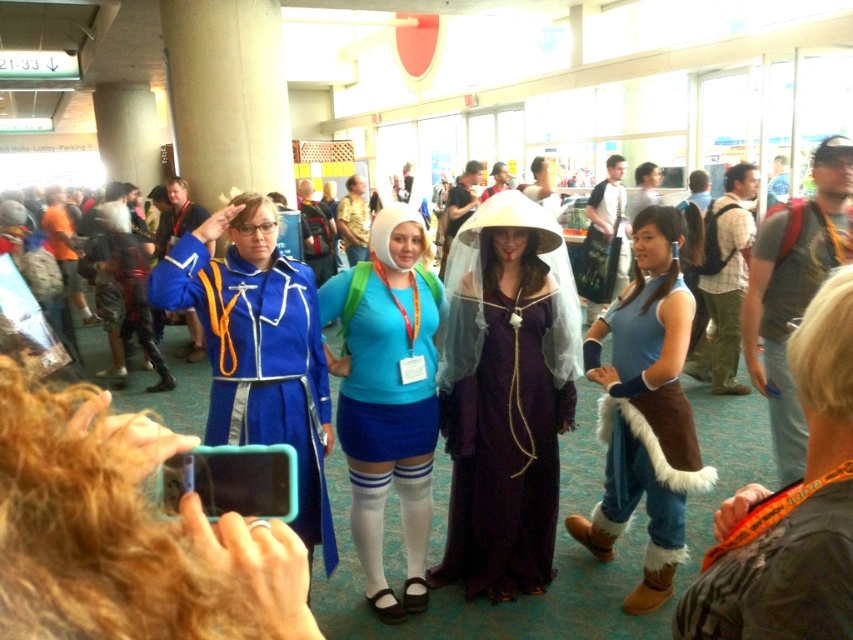
You are a photographer at the event and need to capture a photo of both the blue fabric skirt at center and the blue fabric dress at center in the same frame. Given that your camera has a minimum focus distance of 2.5 inches, will you be able to take the photo without moving either object?

The blue fabric skirt at center is 2.47 inches from the blue fabric dress at center. Since the distance between them is less than the camera minimum focus distance of 2.5 inches, you cannot take the photo without moving them closer together.

You are a photographer at this event and want to capture a photo that includes both the matte blue uniform at left and the blue suede boots at lower right. Which object should you focus on first to ensure both are in frame?

You should focus on the matte blue uniform at left first since it is closer to the viewer than the blue suede boots at lower right, ensuring both will be in frame when properly focused.